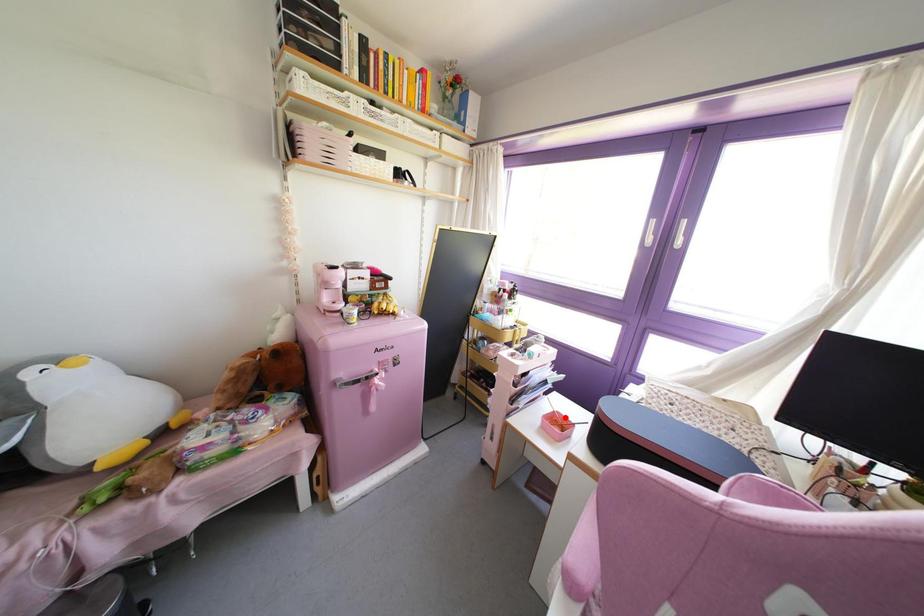
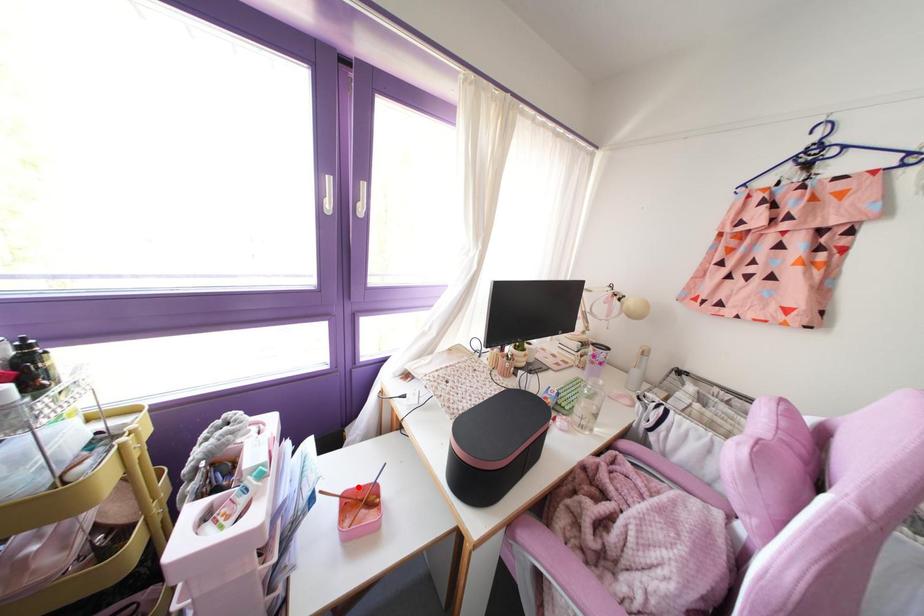
I am providing you with two images of the same scene from different viewpoints. A red point is marked on the first image and another point is marked on the second image. Do the highlighted points in image1 and image2 indicate the same real-world spot?

Yes